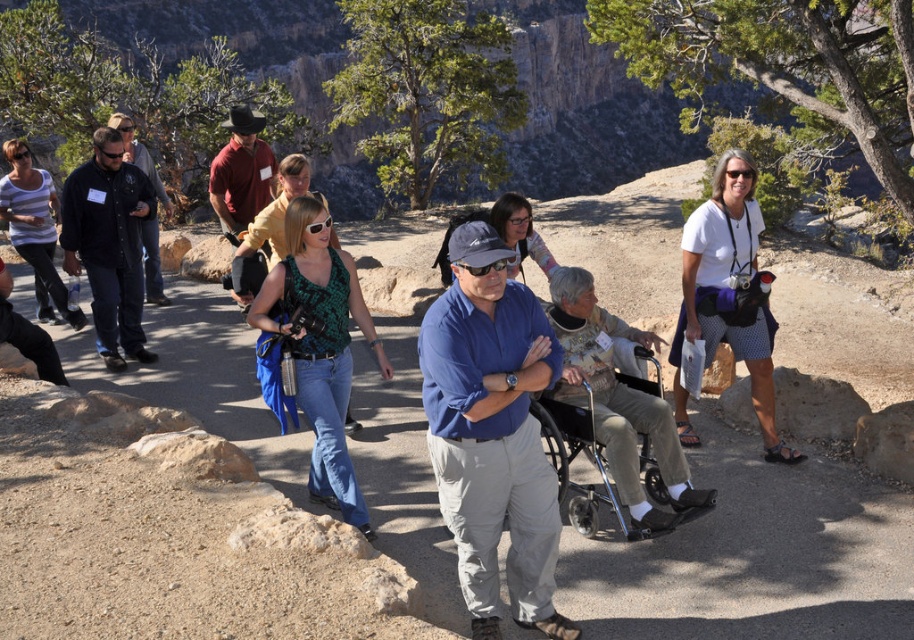
You are a photographer trying to capture a group photo of the two people wearing blue cotton shirt at center and white cotton shirt at center. Since you want both subjects to appear equally tall in the photo, which person should you position closer to the camera?

The blue cotton shirt at center has a lesser height compared to white cotton shirt at center. To make them appear equally tall in the photo, position the blue cotton shirt at center closer to the camera than the white cotton shirt at center.